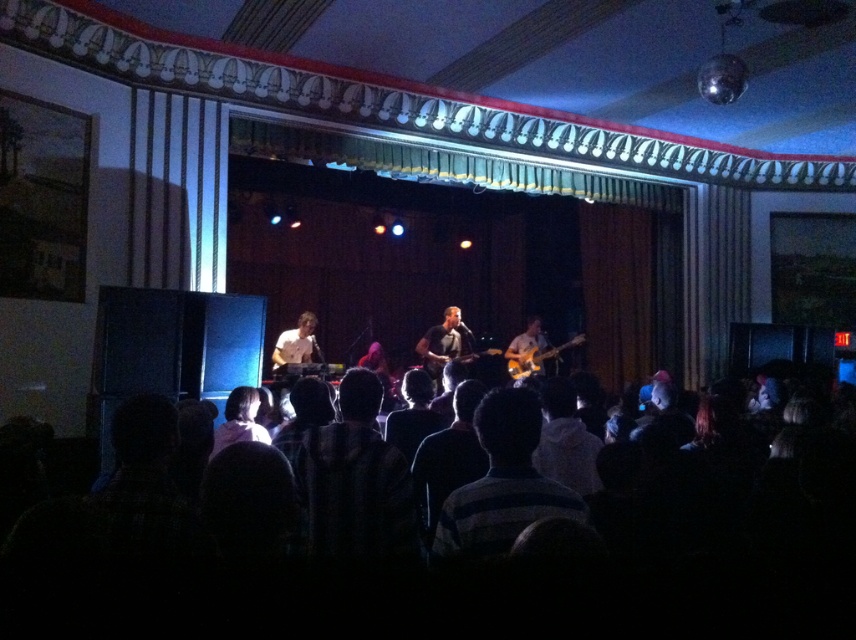
You are standing in the venue and want to move closer to the dark fabric crowd at lower center. If you are 1.68 meters tall, can you comfortably walk to them without needing to bend down?

The distance between you and the dark fabric crowd at lower center is 1.31 meters. Since this distance is shorter than your height of 1.68 meters, you can comfortably walk to them without bending down.

You are a photographer at the back of the venue and want to take a photo that includes both the dark fabric crowd at lower center and the striped cotton shirt at center. The camera you have can only focus on objects within a 12 inch range. Will both subjects be in focus?

The dark fabric crowd at lower center and striped cotton shirt at center are 11.53 inches apart, so yes, both subjects will be within the 12 inch focus range of the camera and thus in focus.

You are a photographer at the back of the venue and want to capture a photo of the orange glossy electric guitar at center without the dark fabric crowd at lower center blocking the view. Based on their positions, is this possible?

The dark fabric crowd at lower center is to the left of orange glossy electric guitar at center, so if you position yourself to the right side of the venue, you can capture the orange glossy electric guitar at center without the crowd blocking the view.